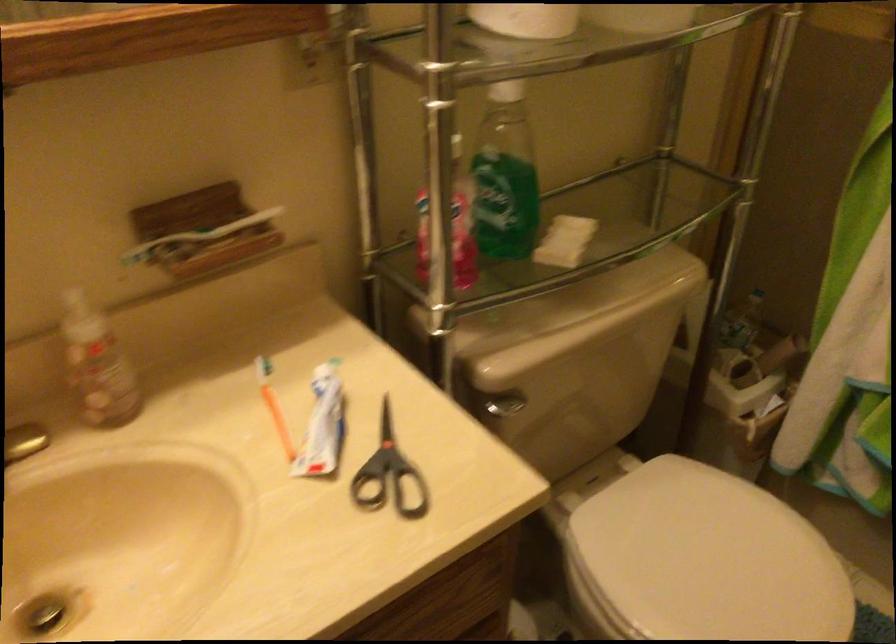
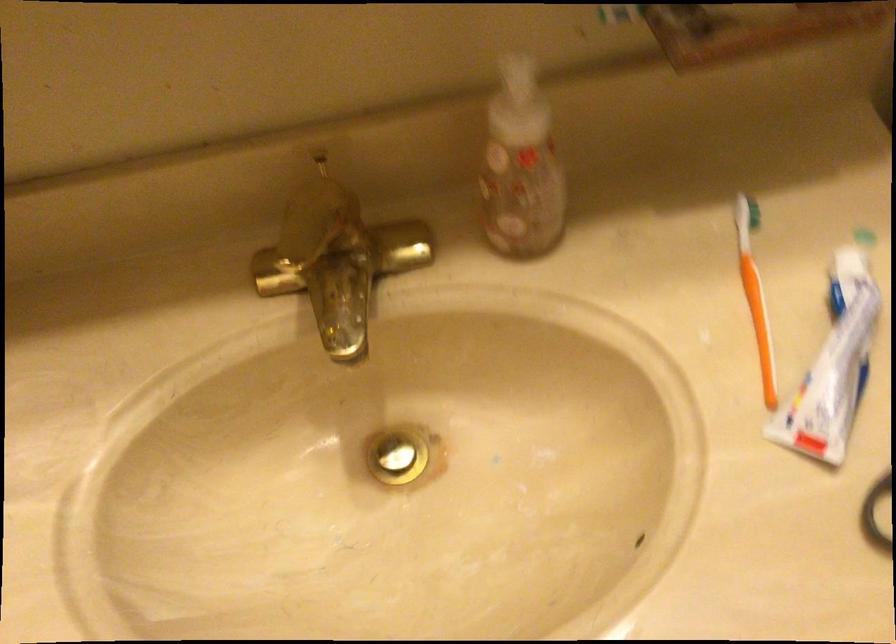
Find the pixel in the second image that matches point 280,404 in the first image.

(755, 295)